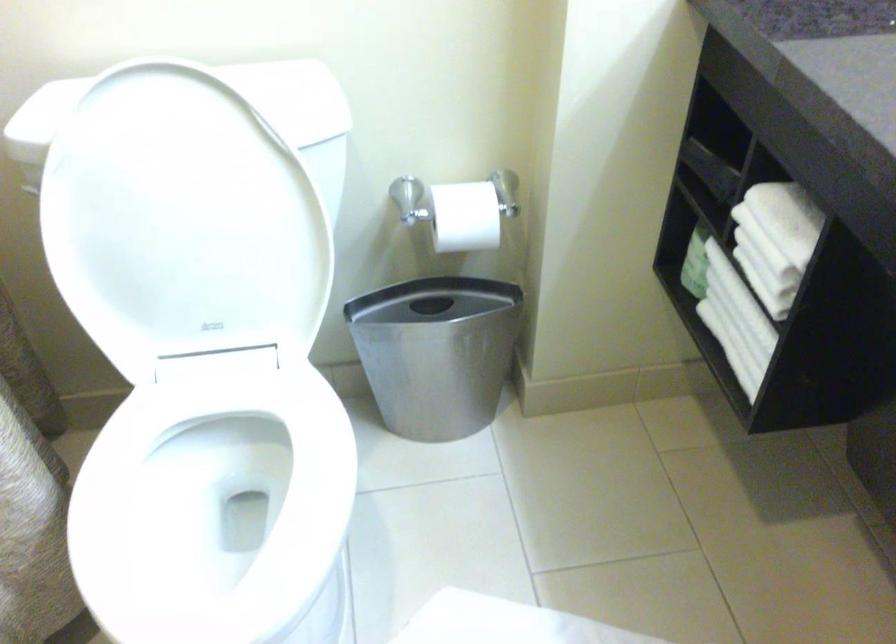
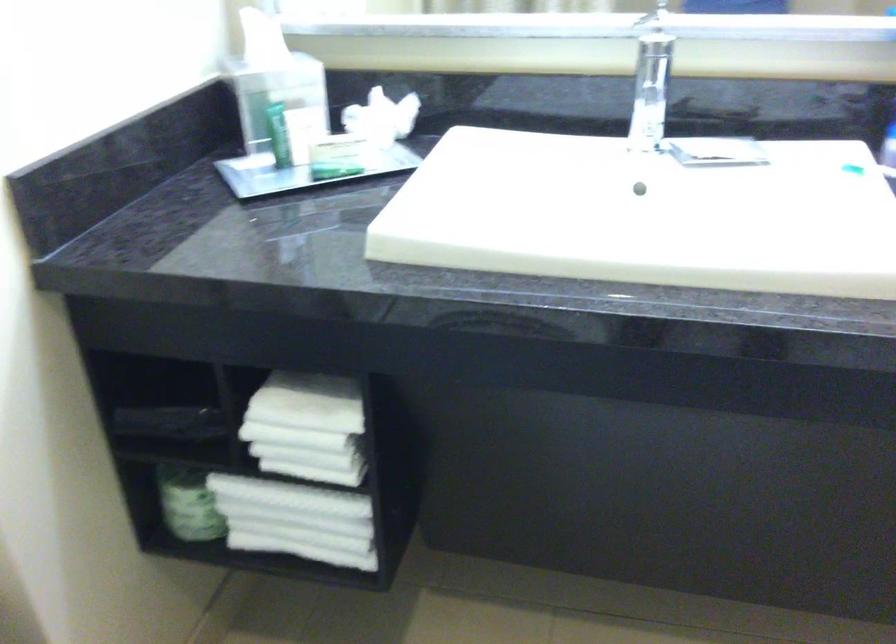
Locate, in the second image, the point that corresponds to point (734, 319) in the first image.

(296, 520)